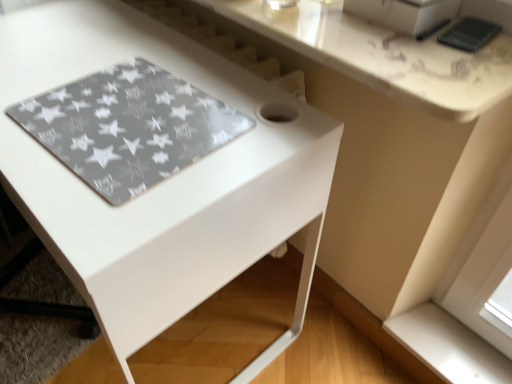
Question: Should I look upward or downward to see transparent star-patterned mat at lower left?

Choices:
 (A) down
 (B) up

Answer: (B)

Question: Considering the relative positions of transparent star-patterned mat at lower left and white glossy counter top at upper center in the image provided, is transparent star-patterned mat at lower left behind white glossy counter top at upper center?

Choices:
 (A) no
 (B) yes

Answer: (B)

Question: Does transparent star-patterned mat at lower left have a greater width compared to white glossy counter top at upper center?

Choices:
 (A) no
 (B) yes

Answer: (A)

Question: Is white glossy counter top at upper center at the back of transparent star-patterned mat at lower left?

Choices:
 (A) yes
 (B) no

Answer: (B)

Question: Can you confirm if transparent star-patterned mat at lower left is bigger than white glossy counter top at upper center?

Choices:
 (A) yes
 (B) no

Answer: (B)

Question: Is transparent star-patterned mat at lower left thinner than white glossy counter top at upper center?

Choices:
 (A) yes
 (B) no

Answer: (A)

Question: Is transparent star-patterned mat at lower left far from white glossy counter top at upper center?

Choices:
 (A) no
 (B) yes

Answer: (A)

Question: Is white glossy counter top at upper center oriented away from white smooth window sill at lower right?

Choices:
 (A) yes
 (B) no

Answer: (B)

Question: Is white glossy counter top at upper center wider than white smooth window sill at lower right?

Choices:
 (A) no
 (B) yes

Answer: (B)

Question: From the image's perspective, is white glossy counter top at upper center under white smooth window sill at lower right?

Choices:
 (A) no
 (B) yes

Answer: (A)

Question: Is white glossy counter top at upper center far from white smooth window sill at lower right?

Choices:
 (A) no
 (B) yes

Answer: (A)

Question: Does white glossy counter top at upper center have a larger size compared to white smooth window sill at lower right?

Choices:
 (A) no
 (B) yes

Answer: (B)

Question: Can we say white glossy counter top at upper center lies outside white smooth window sill at lower right?

Choices:
 (A) no
 (B) yes

Answer: (B)

Question: Are white smooth window sill at lower right and transparent star-patterned mat at lower left far apart?

Choices:
 (A) no
 (B) yes

Answer: (A)